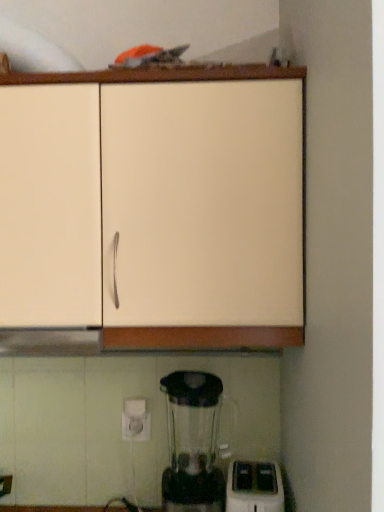
Question: Is white plastic toaster at lower right further to the viewer compared to matte white cabinet at upper center?

Choices:
 (A) yes
 (B) no

Answer: (A)

Question: Are white plastic toaster at lower right and matte white cabinet at upper center making contact?

Choices:
 (A) yes
 (B) no

Answer: (B)

Question: From the image's perspective, is white plastic toaster at lower right below matte white cabinet at upper center?

Choices:
 (A) yes
 (B) no

Answer: (A)

Question: Is white plastic toaster at lower right turned away from matte white cabinet at upper center?

Choices:
 (A) yes
 (B) no

Answer: (B)

Question: Is white plastic toaster at lower right aimed at matte white cabinet at upper center?

Choices:
 (A) no
 (B) yes

Answer: (A)

Question: Does white plastic toaster at lower right have a smaller size compared to matte white cabinet at upper center?

Choices:
 (A) no
 (B) yes

Answer: (B)

Question: Considering the relative sizes of matte white cabinet at upper center and white plastic toaster at lower right in the image provided, is matte white cabinet at upper center wider than white plastic toaster at lower right?

Choices:
 (A) no
 (B) yes

Answer: (B)

Question: Can you confirm if matte white cabinet at upper center is positioned to the right of white plastic toaster at lower right?

Choices:
 (A) yes
 (B) no

Answer: (B)

Question: Is matte white cabinet at upper center looking in the opposite direction of white plastic toaster at lower right?

Choices:
 (A) no
 (B) yes

Answer: (A)

Question: From the image's perspective, is matte white cabinet at upper center located above white plastic toaster at lower right?

Choices:
 (A) no
 (B) yes

Answer: (B)

Question: Does matte white cabinet at upper center come in front of white plastic toaster at lower right?

Choices:
 (A) yes
 (B) no

Answer: (A)

Question: Is matte white cabinet at upper center shorter than white plastic toaster at lower right?

Choices:
 (A) no
 (B) yes

Answer: (A)

Question: Considering their positions, is white plastic toaster at lower right located in front of or behind matte white cabinet at upper center?

Choices:
 (A) behind
 (B) front

Answer: (A)